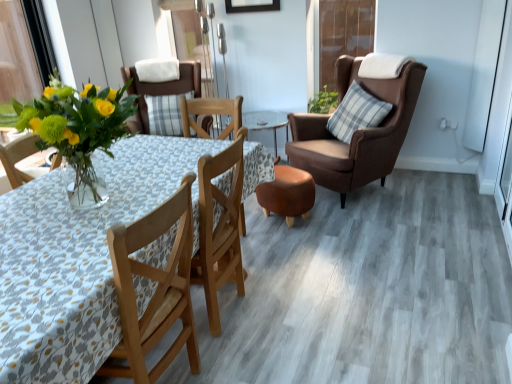
Question: Is matte glass vase with yellow flowers at left at the left side of matte brown chair at center, the 2th chair when ordered from right to left?

Choices:
 (A) yes
 (B) no

Answer: (B)

Question: Can you confirm if matte glass vase with yellow flowers at left is positioned to the right of matte brown chair at center, which is counted as the first chair, starting from the left?

Choices:
 (A) yes
 (B) no

Answer: (A)

Question: Does matte glass vase with yellow flowers at left have a lesser width compared to matte brown chair at center, the 2th chair when ordered from right to left?

Choices:
 (A) yes
 (B) no

Answer: (A)

Question: Could you tell me if matte glass vase with yellow flowers at left is turned towards matte brown chair at center, the 2th chair when ordered from right to left?

Choices:
 (A) yes
 (B) no

Answer: (B)

Question: From the image's perspective, is matte glass vase with yellow flowers at left under matte brown chair at center, which is counted as the first chair, starting from the left?

Choices:
 (A) no
 (B) yes

Answer: (B)

Question: From the image's perspective, is transparent plastic screen door at upper center above or below brown leather chair at right, which ranks as the second chair in left-to-right order?

Choices:
 (A) below
 (B) above

Answer: (B)

Question: Considering the positions of transparent plastic screen door at upper center and brown leather chair at right, placed as the first chair when sorted from right to left, in the image, is transparent plastic screen door at upper center taller or shorter than brown leather chair at right, placed as the first chair when sorted from right to left,?

Choices:
 (A) tall
 (B) short

Answer: (B)

Question: Considering the positions of point (348, 26) and point (382, 135), is point (348, 26) closer or farther from the camera than point (382, 135)?

Choices:
 (A) farther
 (B) closer

Answer: (A)

Question: In terms of width, does transparent plastic screen door at upper center look wider or thinner when compared to brown leather chair at right, which ranks as the second chair in left-to-right order?

Choices:
 (A) thin
 (B) wide

Answer: (A)

Question: Visually, is matte glass vase with yellow flowers at left positioned to the left or to the right of transparent plastic screen door at upper center?

Choices:
 (A) right
 (B) left

Answer: (B)

Question: Which is correct: matte glass vase with yellow flowers at left is inside transparent plastic screen door at upper center, or outside of it?

Choices:
 (A) inside
 (B) outside

Answer: (B)

Question: Considering the positions of matte glass vase with yellow flowers at left and transparent plastic screen door at upper center in the image, is matte glass vase with yellow flowers at left bigger or smaller than transparent plastic screen door at upper center?

Choices:
 (A) small
 (B) big

Answer: (B)

Question: From the image's perspective, is matte glass vase with yellow flowers at left located above or below transparent plastic screen door at upper center?

Choices:
 (A) below
 (B) above

Answer: (A)

Question: Looking at the image, does matte brown chair at center, which is counted as the first chair, starting from the left, seem bigger or smaller compared to transparent plastic screen door at upper center?

Choices:
 (A) small
 (B) big

Answer: (B)

Question: Considering the positions of matte brown chair at center, which is counted as the first chair, starting from the left, and transparent plastic screen door at upper center in the image, is matte brown chair at center, which is counted as the first chair, starting from the left, wider or thinner than transparent plastic screen door at upper center?

Choices:
 (A) thin
 (B) wide

Answer: (B)